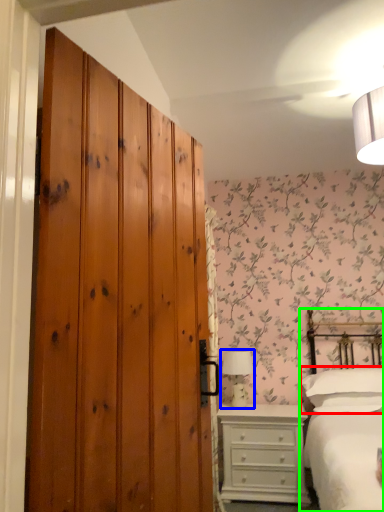
Question: Which object is positioned farthest from pillow (highlighted by a red box)? Select from table lamp (highlighted by a blue box) and bed (highlighted by a green box).

Choices:
 (A) table lamp
 (B) bed

Answer: (A)